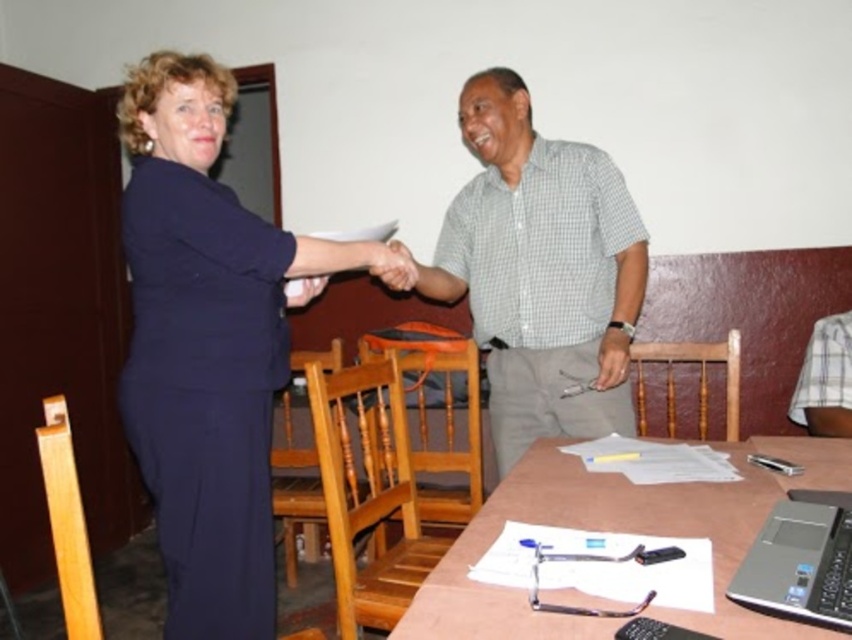
Can you confirm if gray checkered shirt at center is taller than matte black hand at center?

Indeed, gray checkered shirt at center has a greater height compared to matte black hand at center.

Does gray checkered shirt at center appear over matte black hand at center?

No, gray checkered shirt at center is not above matte black hand at center.

At what (x,y) coordinates should I click in order to perform the action: click on gray checkered shirt at center. Please return your answer as a coordinate pair (x, y). This screenshot has width=852, height=640. Looking at the image, I should click on (540, 269).

Between point (530, 404) and point (502, 618), which one is positioned in front?

Positioned in front is point (502, 618).

Is gray checkered shirt at center bigger than wooden table at center?

Correct, gray checkered shirt at center is larger in size than wooden table at center.

What do you see at coordinates (540, 269) in the screenshot? The width and height of the screenshot is (852, 640). I see `gray checkered shirt at center` at bounding box center [540, 269].

Image resolution: width=852 pixels, height=640 pixels. I want to click on gray checkered shirt at center, so click(x=540, y=269).

Which is more to the right, dark blue fabric dress at upper left or wooden table at center?

From the viewer's perspective, wooden table at center appears more on the right side.

Can you confirm if dark blue fabric dress at upper left is positioned to the left of wooden table at center?

Yes, dark blue fabric dress at upper left is to the left of wooden table at center.

From the picture: Who is more forward, (202, 236) or (482, 545)?

Point (482, 545) is more forward.

Image resolution: width=852 pixels, height=640 pixels. Find the location of `dark blue fabric dress at upper left`. dark blue fabric dress at upper left is located at coordinates tap(206, 346).